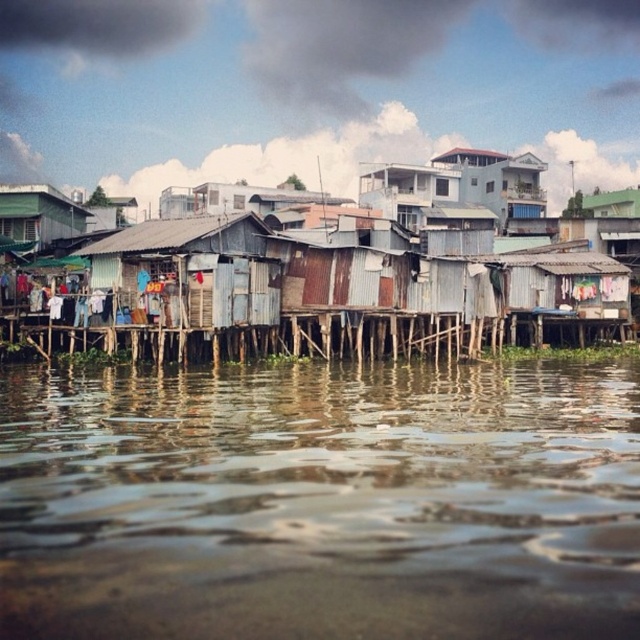
Question: Does rusty corrugated metal shacks at center lie behind rusty corrugated metal hut at center?

Choices:
 (A) no
 (B) yes

Answer: (B)

Question: Which object is positioned farthest from the rusty corrugated metal shacks at center?

Choices:
 (A) brown reflective water at lower center
 (B) rusty corrugated metal hut at center
 (C) green corrugated metal hut at left

Answer: (A)

Question: Which object is closer to the camera taking this photo?

Choices:
 (A) brown reflective water at lower center
 (B) rusty corrugated metal hut at center

Answer: (A)

Question: From the image, what is the correct spatial relationship of rusty corrugated metal shacks at center in relation to rusty corrugated metal hut at center?

Choices:
 (A) above
 (B) below

Answer: (A)

Question: Can you confirm if brown reflective water at lower center is positioned to the left of rusty corrugated metal hut at center?

Choices:
 (A) yes
 (B) no

Answer: (B)

Question: Which point appears farthest from the camera in this image?

Choices:
 (A) (534, 189)
 (B) (253, 589)
 (C) (205, 305)

Answer: (A)